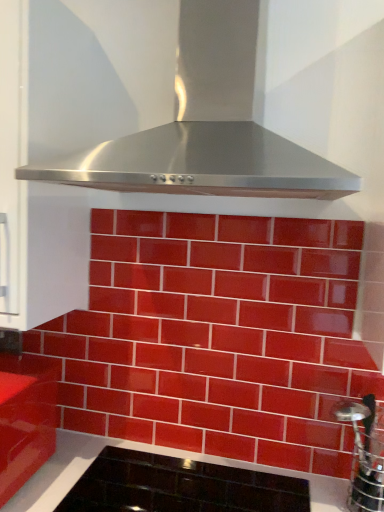
Question: Does glossy ceramic tiles at center have a larger size compared to stainless steel range hood at upper center?

Choices:
 (A) no
 (B) yes

Answer: (A)

Question: Is glossy ceramic tiles at center next to stainless steel range hood at upper center and touching it?

Choices:
 (A) yes
 (B) no

Answer: (B)

Question: Is there a large distance between glossy ceramic tiles at center and stainless steel range hood at upper center?

Choices:
 (A) no
 (B) yes

Answer: (A)

Question: From the image's perspective, is glossy ceramic tiles at center under stainless steel range hood at upper center?

Choices:
 (A) yes
 (B) no

Answer: (A)

Question: Is stainless steel range hood at upper center at the back of glossy ceramic tiles at center?

Choices:
 (A) no
 (B) yes

Answer: (A)

Question: Does glossy ceramic tiles at center turn towards stainless steel range hood at upper center?

Choices:
 (A) yes
 (B) no

Answer: (B)

Question: From a real-world perspective, is glossy red cabinet at lower left located higher than glossy ceramic tiles at center?

Choices:
 (A) yes
 (B) no

Answer: (B)

Question: Is glossy red cabinet at lower left positioned in front of glossy ceramic tiles at center?

Choices:
 (A) no
 (B) yes

Answer: (B)

Question: Can you confirm if glossy red cabinet at lower left is bigger than glossy ceramic tiles at center?

Choices:
 (A) no
 (B) yes

Answer: (A)

Question: Does glossy red cabinet at lower left appear on the left side of glossy ceramic tiles at center?

Choices:
 (A) no
 (B) yes

Answer: (B)

Question: From the image's perspective, is glossy red cabinet at lower left located beneath glossy ceramic tiles at center?

Choices:
 (A) no
 (B) yes

Answer: (B)

Question: Is glossy red cabinet at lower left completely or partially outside of glossy ceramic tiles at center?

Choices:
 (A) yes
 (B) no

Answer: (A)

Question: Is stainless steel at right located outside stainless steel range hood at upper center?

Choices:
 (A) no
 (B) yes

Answer: (B)